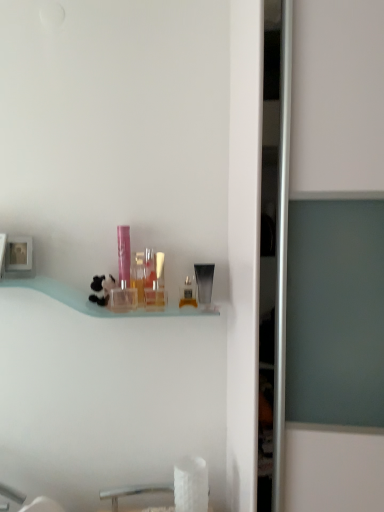
Question: Do you think translucent plastic container at center, the 2th toiletry viewed from the left, is within clear plastic bottle at center, the 5th toiletry in the left-to-right sequence, or outside of it?

Choices:
 (A) inside
 (B) outside

Answer: (B)

Question: Considering the positions of translucent plastic container at center, the 2th toiletry viewed from the left, and clear plastic bottle at center, which is counted as the 2th toiletry, starting from the right, in the image, is translucent plastic container at center, the 2th toiletry viewed from the left, taller or shorter than clear plastic bottle at center, which is counted as the 2th toiletry, starting from the right,?

Choices:
 (A) short
 (B) tall

Answer: (B)

Question: Which of these objects is positioned farthest from the white matte toilet paper at lower center?

Choices:
 (A) clear plastic container at center, the 3th toiletry positioned from the left
 (B) translucent plastic container at center, the fifth toiletry in the right-to-left sequence
 (C) pink glossy tube at center, the first toiletry from the left
 (D) clear plastic bottle at center, the 5th toiletry in the left-to-right sequence
 (E) clear plastic container at center, placed as the 1th toiletry when sorted from right to left

Answer: (C)

Question: Estimate the real-world distances between objects in this image. Which object is farther from the white matte toilet paper at lower center?

Choices:
 (A) clear plastic container at center, placed as the 4th toiletry when sorted from right to left
 (B) clear plastic bottle at center, which is counted as the 2th toiletry, starting from the right
 (C) clear plastic container at center, which ranks as the sixth toiletry in left-to-right order
 (D) translucent plastic perfume bottle at center, the 4th toiletry when ordered from left to right
 (E) translucent plastic container at center, the 2th toiletry viewed from the left

Answer: (E)